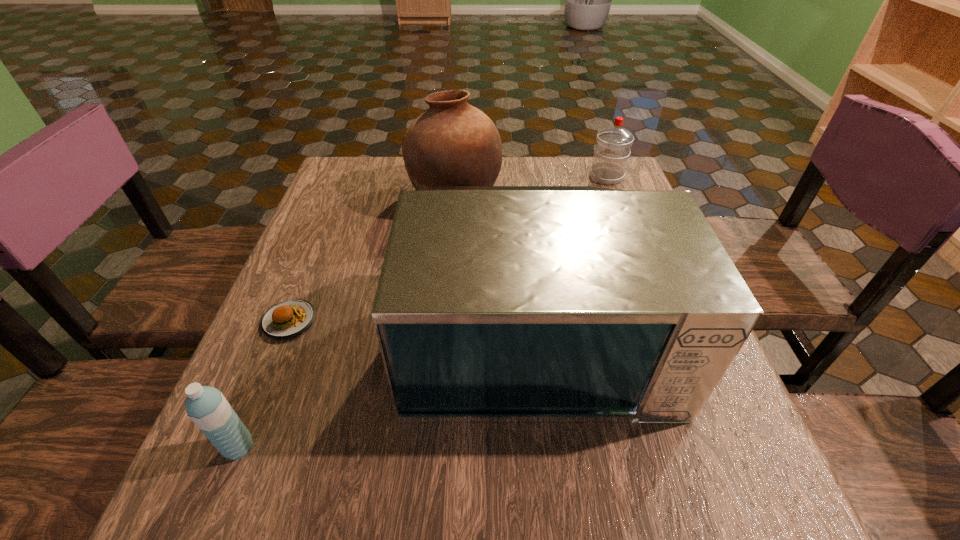
Locate an element on the screen. This screenshot has height=540, width=960. free region that satisfies the following two spatial constraints: 1. on the front side of the food; 2. on the left side of the nearest object is located at coordinates (237, 448).